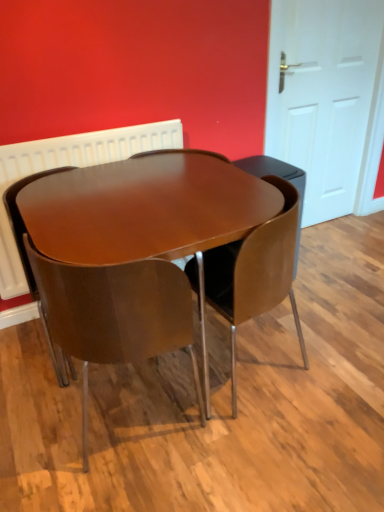
Where is `vacant area in front of brown leather chair at center, which is counted as the first chair, starting from the right`? The height and width of the screenshot is (512, 384). vacant area in front of brown leather chair at center, which is counted as the first chair, starting from the right is located at coordinates (276, 445).